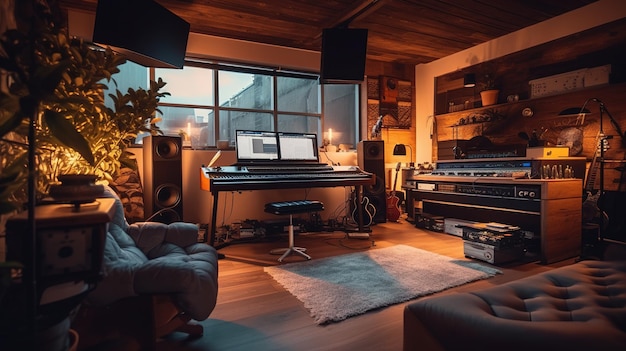
Identify the location of right monitor. The image size is (626, 351). (300, 151).